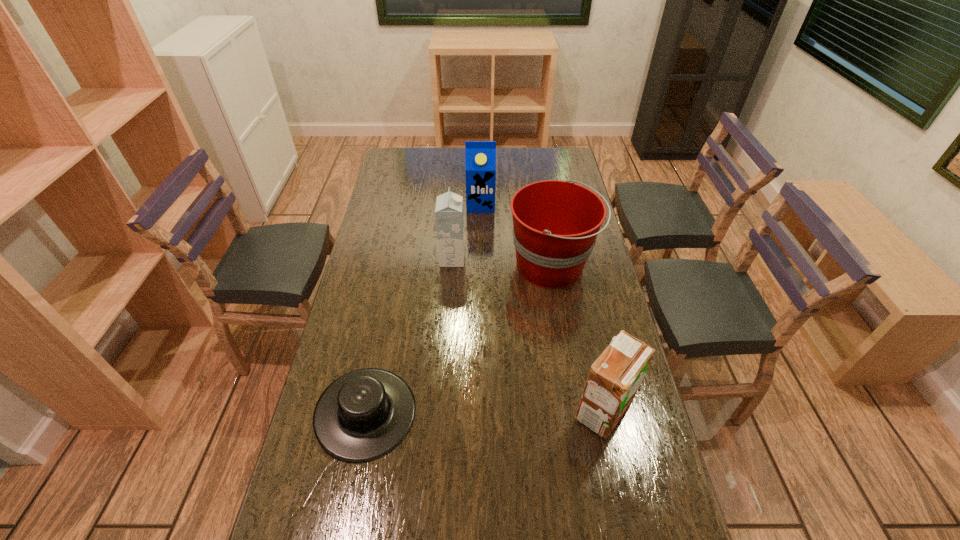
The image size is (960, 540). In order to click on the farthest object in this screenshot , I will do `click(480, 156)`.

Where is `the second carton from right to left`? the second carton from right to left is located at coordinates (480, 156).

The width and height of the screenshot is (960, 540). In order to click on the leftmost carton in this screenshot , I will do `click(449, 218)`.

Where is `the second farthest carton`? the second farthest carton is located at coordinates (449, 218).

This screenshot has height=540, width=960. I want to click on bucket, so click(555, 223).

Find the location of a particular element. The height and width of the screenshot is (540, 960). the rightmost carton is located at coordinates coord(614,378).

Find the location of a particular element. the shortest object is located at coordinates (364, 414).

This screenshot has height=540, width=960. What are the coordinates of `dress hat` in the screenshot? It's located at (364, 414).

Where is `free location located 0.310m with the cap open on the third object from left to right`? The width and height of the screenshot is (960, 540). free location located 0.310m with the cap open on the third object from left to right is located at coordinates (481, 265).

This screenshot has width=960, height=540. What are the coordinates of `free space located on the front label of the leftmost carton` in the screenshot? It's located at (486, 259).